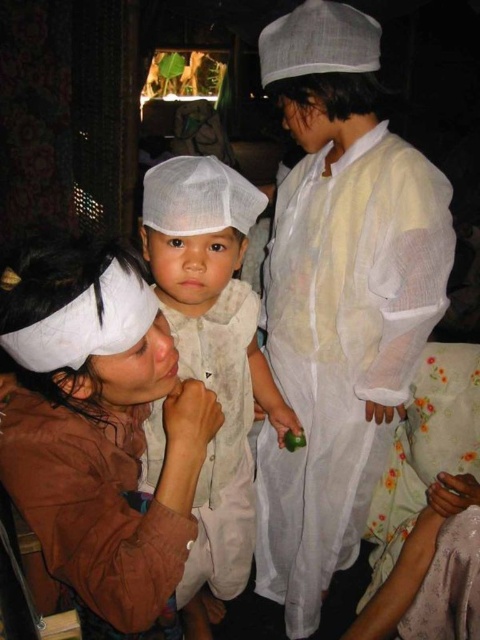
You are an observer standing in the room. You need to locate the brown suede jacket at lower left. Which direction should you look relative to the white sheer robe at center?

The white sheer robe at center is to the right of the brown suede jacket at lower left, so you should look to the left of the white sheer robe at center to find the brown suede jacket at lower left.

You are organizing a clothing donation drive and need to determine if the brown suede jacket at lower left can fit inside the white cotton hat at center. Based on their sizes, will the jacket fit inside the hat?

The brown suede jacket at lower left has a smaller size compared to the white cotton hat at center, so the jacket can fit inside the hat.

You are an interior designer assessing the layout of this traditional indoor setting. You notice the white sheer robe at center and the brown suede jacket at lower left. Based on their sizes, which object would require more vertical space to hang properly?

The white sheer robe at center requires more vertical space because it has a greater height compared to the brown suede jacket at lower left.